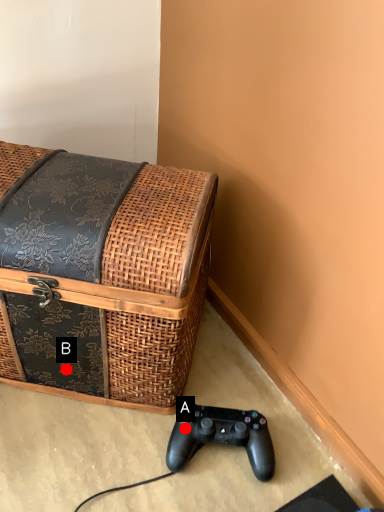
Question: Two points are circled on the image, labeled by A and B beside each circle. Which point appears closest to the camera in this image?

Choices:
 (A) A is closer
 (B) B is closer

Answer: (A)